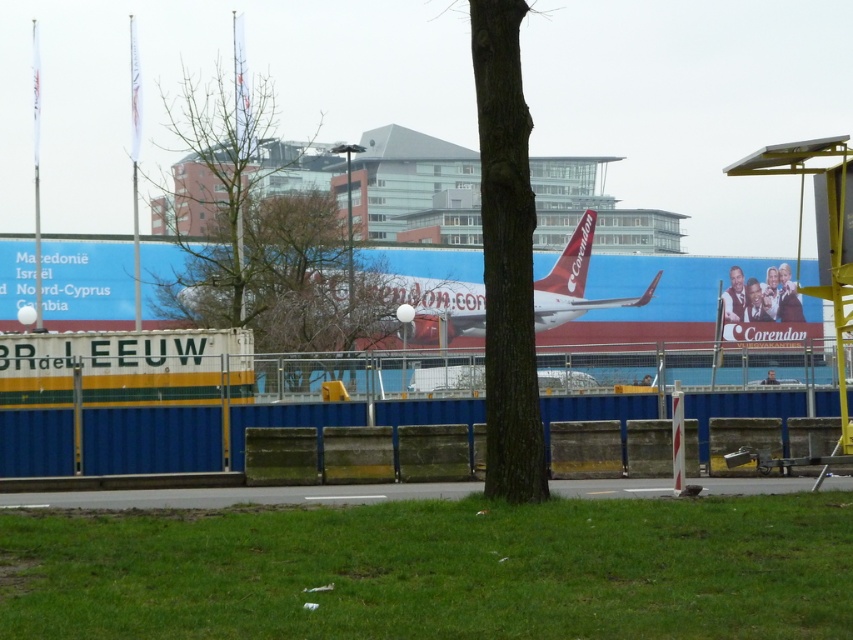
You are standing at the camera position looking at the outdoor urban scene. There is a specific point at coordinates point [453,493]. If you want to throw a frisbee to reach that point, will it be possible for you to reach it with a throw of 20 meters?

The distance of point [453,493] from camera is 20.51 meters, so you cannot reach it with a throw of 20 meters as it is slightly farther.

You are a delivery person trying to park your van between the gray asphalt at lower center and the red matte airliner at center. Can you fit your van there if your van is 2 meters wide?

The gray asphalt at lower center is thinner than the red matte airliner at center. Since the gray asphalt at lower center is the narrower one, and the van is 2 meters wide, it depends on the actual width of the asphalt. However, since the description only states that the asphalt is thinner than the airliner but doesn not provide exact measurements, we cannot definitively determine if the van will fit. More information is needed about the specific widths of both objects.